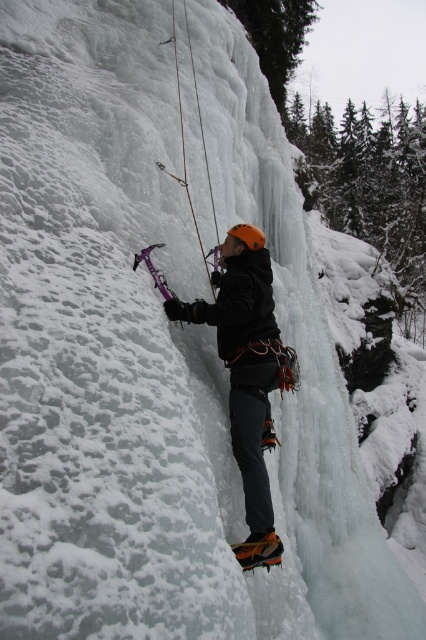
You are an observer watching the ice climber. You notice the matte black jacket at center and the orange matte helmet at center. Which object is positioned lower on the climber?

The matte black jacket at center is located below the orange matte helmet at center, so the matte black jacket at center is positioned lower on the climber.

You are an ice climber looking at the image. You need to check if your matte black jacket at center is positioned in the upper half of the ice wall. Based on the coordinates provided, can you confirm its location?

The matte black jacket at center is located at point coordinates of [247,378]. Since the y coordinate is 0.582, which is above the midpoint of 0.5, it is positioned in the upper half of the ice wall.

You are an ice climber preparing to adjust your gear. You have a matte black jacket at center and an orange matte helmet at center. Which item should you prioritize packing into your backpack first if you need to carry both items and have limited space?

The matte black jacket at center is bigger than the orange matte helmet at center, so you should prioritize packing the matte black jacket at center first to ensure both items fit into the backpack.